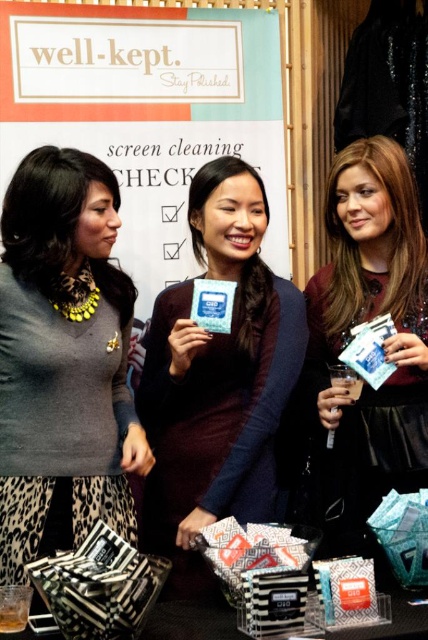
Is matte gray sweater at center smaller than black striped fabric at lower left?

Incorrect, matte gray sweater at center is not smaller in size than black striped fabric at lower left.

Which is more to the left, matte gray sweater at center or black striped fabric at lower left?

From the viewer's perspective, matte gray sweater at center appears more on the left side.

At what (x,y) coordinates should I click in order to perform the action: click on matte gray sweater at center. Please return your answer as a coordinate pair (x, y). Looking at the image, I should click on (64, 358).

Identify the location of matte gray sweater at center. (64, 358).

Can you confirm if matte blue card at center is taller than black striped fabric at lower left?

Indeed, matte blue card at center has a greater height compared to black striped fabric at lower left.

How distant is matte blue card at center from black striped fabric at lower left?

matte blue card at center and black striped fabric at lower left are 22.30 inches apart.

Does point (243, 468) come behind point (139, 584)?

Yes, it is behind point (139, 584).

Find the location of `matte blue card at center`. matte blue card at center is located at coordinates point(217,380).

Does point (297, 314) come behind point (339, 406)?

Yes, it is behind point (339, 406).

Identify the location of matte blue card at center. (217, 380).

Which is in front, point (178, 502) or point (366, 422)?

Point (178, 502)

Identify the location of matte blue card at center. (217, 380).